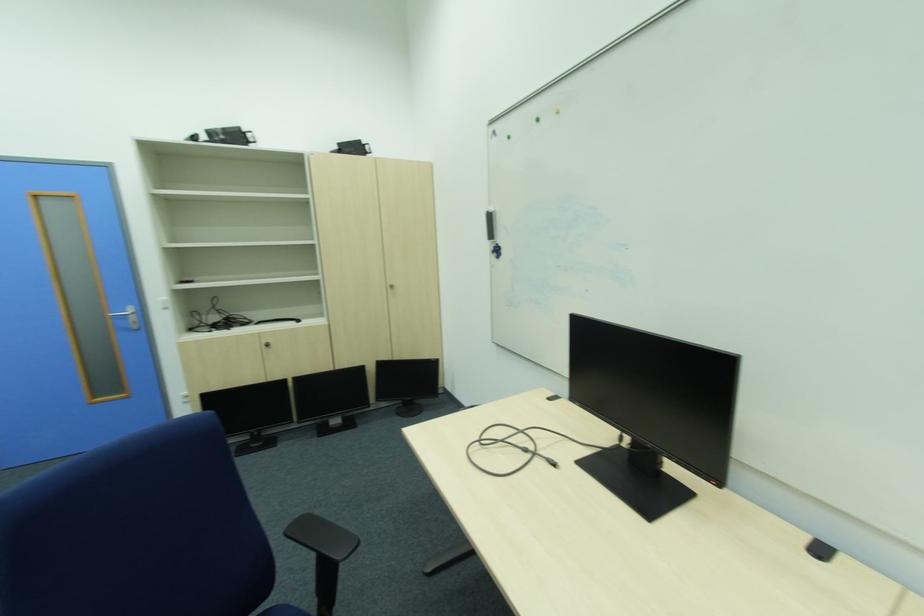
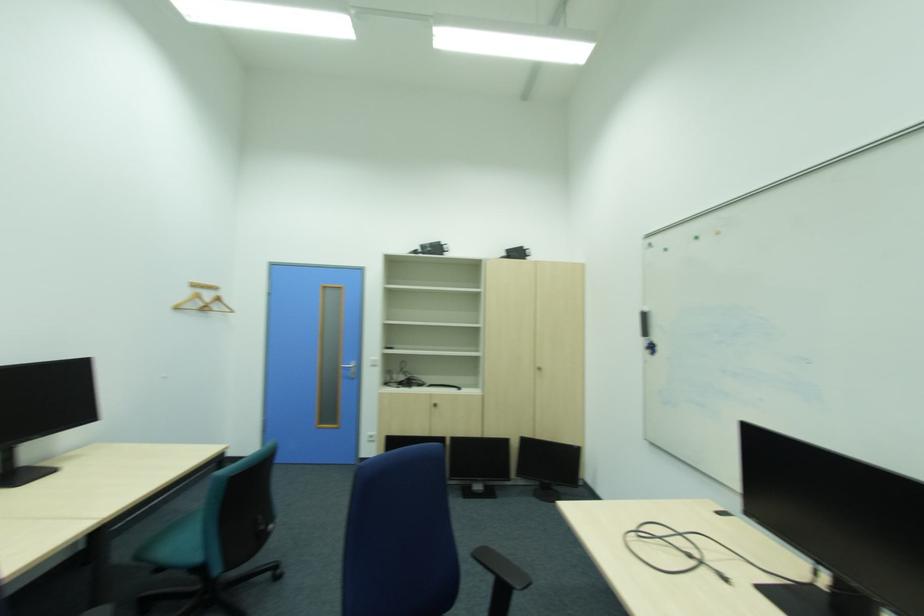
Question: What movement of the cameraman would produce the second image?

Choices:
 (A) Left
 (B) Right
 (C) Forward
 (D) Backward

Answer: (D)